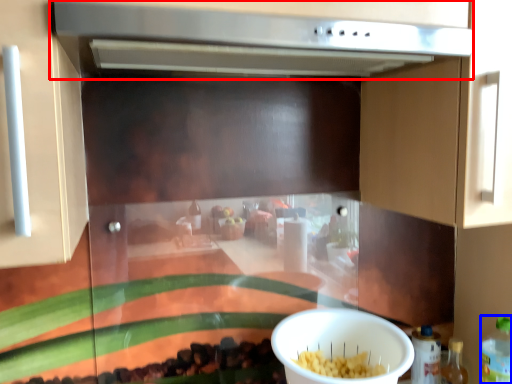
Question: Among these objects, which one is nearest to the camera, vent (highlighted by a red box) or bottle (highlighted by a blue box)?

Choices:
 (A) vent
 (B) bottle

Answer: (A)